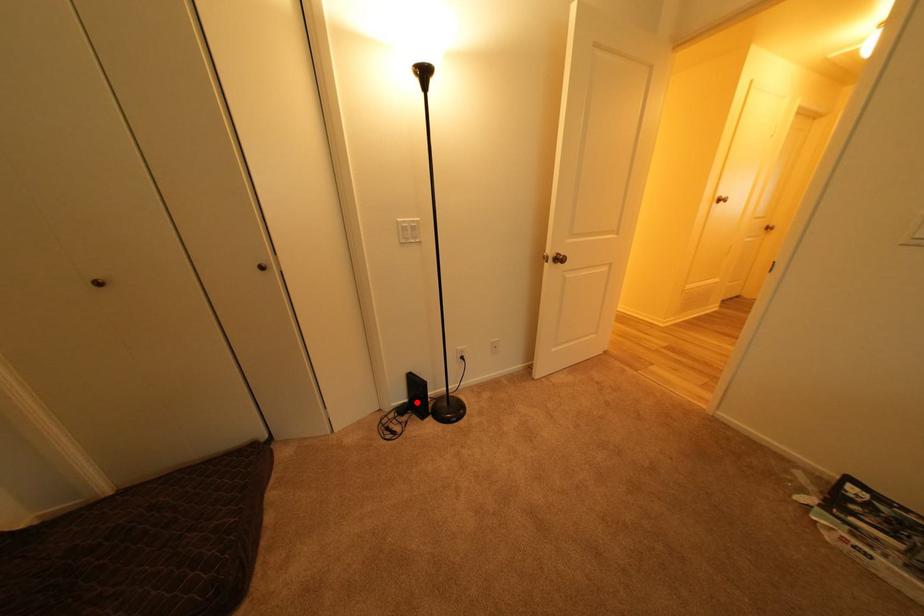
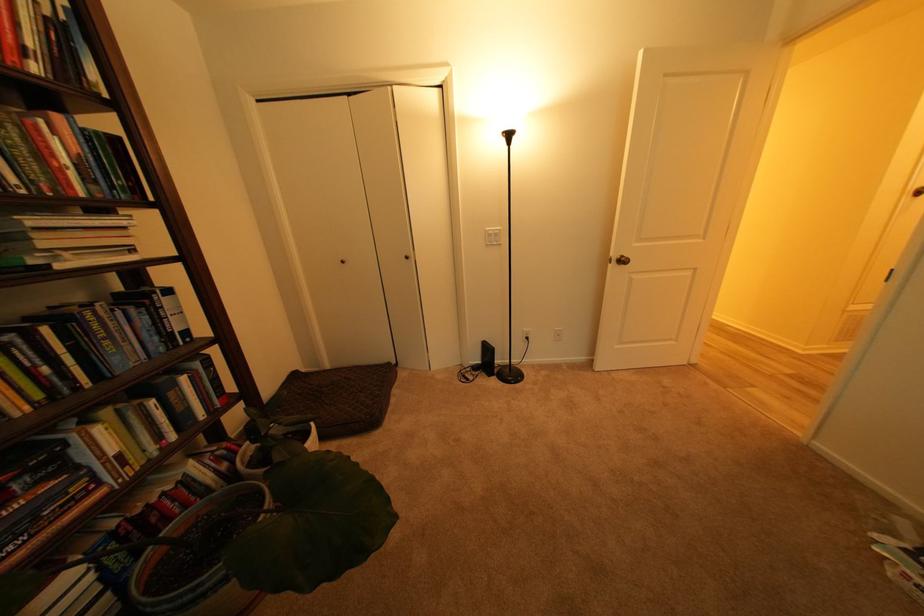
Where in the second image is the point corresponding to the highlighted location from the first image?

(490, 363)